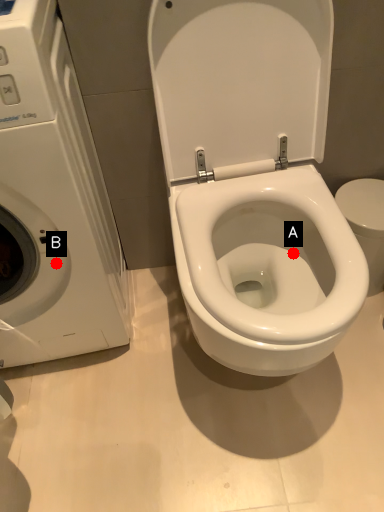
Question: Two points are circled on the image, labeled by A and B beside each circle. Which point is farther from the camera taking this photo?

Choices:
 (A) A is further
 (B) B is further

Answer: (A)